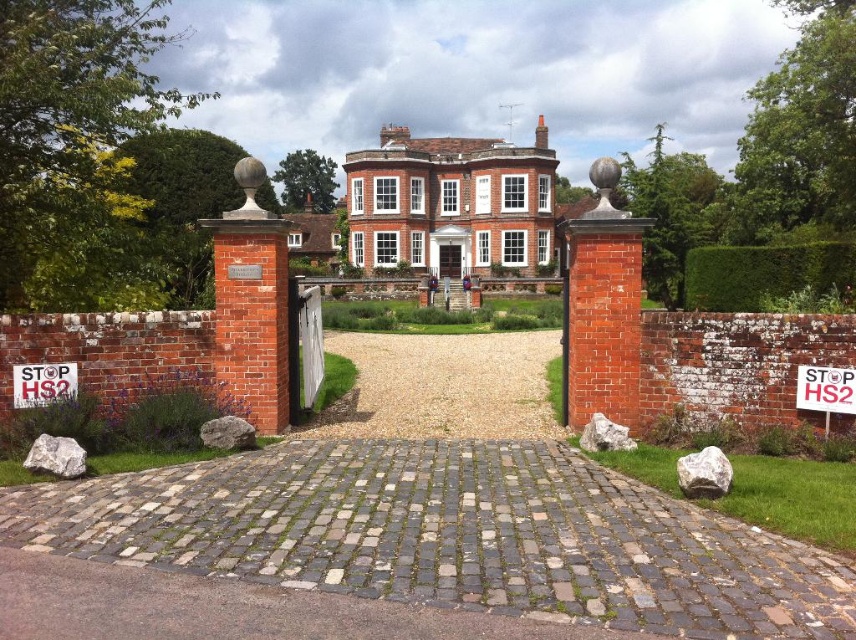
Question: Considering the real-world distances, which object is closest to the white paper sign at left?

Choices:
 (A) white paper sign at center
 (B) gray cobblestone driveway at center
 (C) green leafy hedge at right
 (D) gravel at center

Answer: (B)

Question: Which object is farther from the camera taking this photo?

Choices:
 (A) white paper sign at center
 (B) white paper sign at left
 (C) gravel at center
 (D) green leafy hedge at right

Answer: (D)

Question: Can you confirm if gravel at center is positioned to the right of white paper sign at left?

Choices:
 (A) no
 (B) yes

Answer: (B)

Question: Which is farther from the white paper sign at left?

Choices:
 (A) green leafy hedge at right
 (B) gray cobblestone driveway at center

Answer: (A)

Question: Is gravel at center further to camera compared to white paper sign at left?

Choices:
 (A) yes
 (B) no

Answer: (A)

Question: Where is gravel at center located in relation to white paper sign at left in the image?

Choices:
 (A) below
 (B) above

Answer: (A)